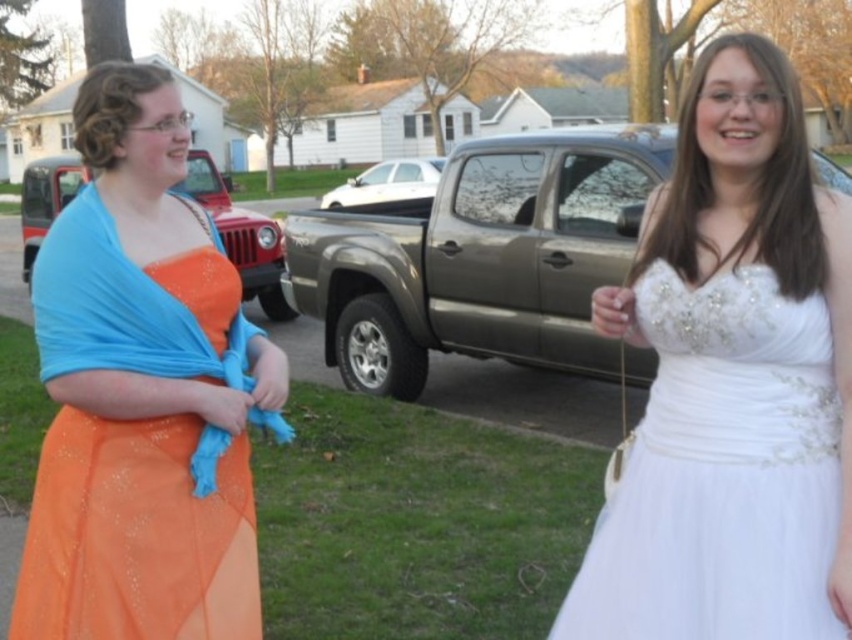
You are a photographer at a prom event and need to arrange the two prom attendees, the white satin dress at center and the orange satin dress at left, so that they face each other. Based on their current positions, which attendee should move to the right to face the other?

The orange satin dress at left should move to the right to face the white satin dress at center since the white satin dress at center is currently positioned to the right of the orange satin dress at left.

You are a photographer trying to capture a closeup shot of the white satin dress at center. Based on its position at point 0.597, 0.860, where should you focus your camera lens to ensure the dress is in the center of the frame?

The white satin dress at center is already positioned at point (732, 381), so you should focus your camera lens on that coordinate to keep the dress centered in the frame.

You are a photographer setting up for a photoshoot and need to arrange two mannequins wearing the white satin dress at center and the orange satin dress at left. Since the dresses have different widths, which dress should you place closer to the camera to ensure both appear equally wide in the photo?

The white satin dress at center is thinner than the orange satin dress at left. To make both appear equally wide in the photo, place the thinner white satin dress at center closer to the camera and the thicker orange satin dress at left further back. This adjustment compensensates for their width difference through perspective.